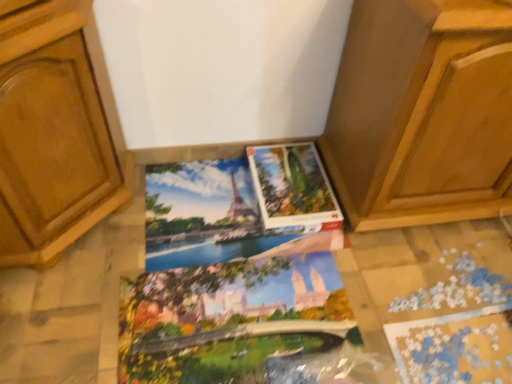
Where is `free space in front of wooden cabinet at center`? free space in front of wooden cabinet at center is located at coordinates (425, 290).